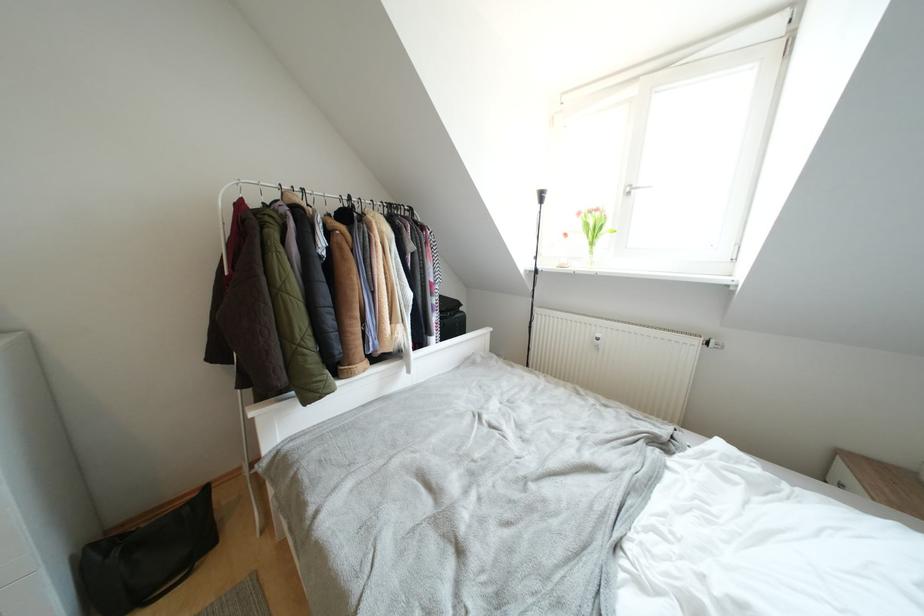
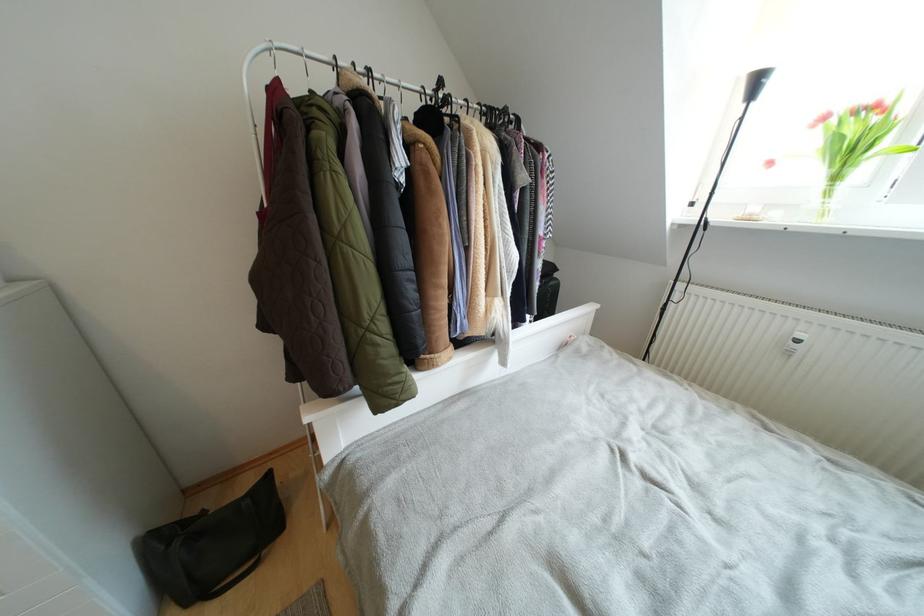
The images are taken continuously from a first-person perspective. In which direction are you moving?

The cameraman walked toward left, forward.